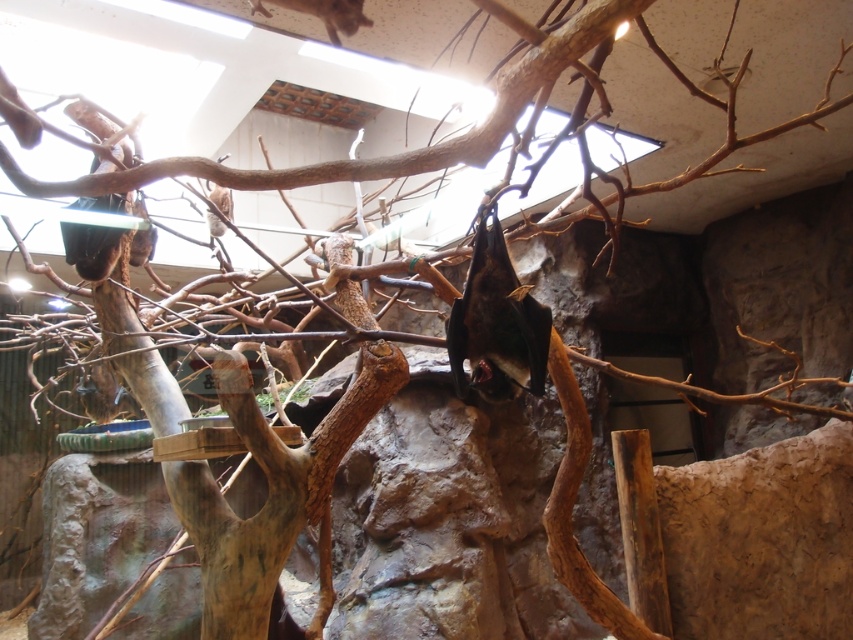
You are a wildlife researcher observing bats in their enclosure. You notice two bats hanging from branches. The first is a dark brown fur bat at center, and the second is a brown fur bat at upper center. You need to place a food dispenser between them. What is the minimum distance the dispenser should be placed from each bat to ensure it is equidistant?

The minimum distance the dispenser should be placed from each bat to ensure it is equidistant is 0.525 meters, which is half of the 1.05 meters separating them.

You are a wildlife researcher observing the bat enclosure. You notice two bats hanging from branches. One is the dark brown fur bat at center and the other is the brown fur bat at upper center. Which bat is positioned lower in the enclosure?

The dark brown fur bat at center is positioned lower than the brown fur bat at upper center because it is located at the center, which is below the upper center position.

You are a wildlife photographer aiming to capture a closeup shot of the bats in their enclosure. You have a camera with a lens that can focus on objects up to 1 meter wide. Which bat, the dark brown fur bat at center or the brown fur bat at upper center, can the camera focus on?

The dark brown fur bat at center has a lesser width compared to the brown fur bat at upper center. Since the camera can focus on objects up to 1 meter wide, the dark brown fur bat at center is more likely to fit within the focus range of the camera.